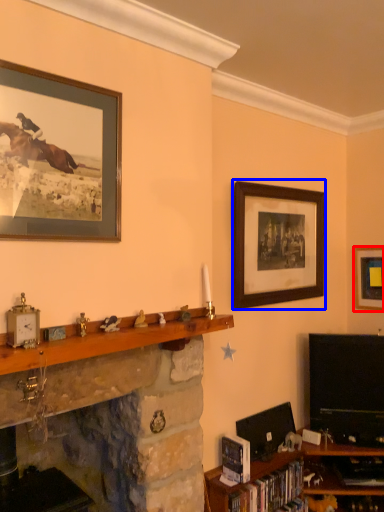
Question: Which object appears farthest to the camera in this image, picture frame (highlighted by a red box) or picture frame (highlighted by a blue box)?

Choices:
 (A) picture frame
 (B) picture frame

Answer: (A)